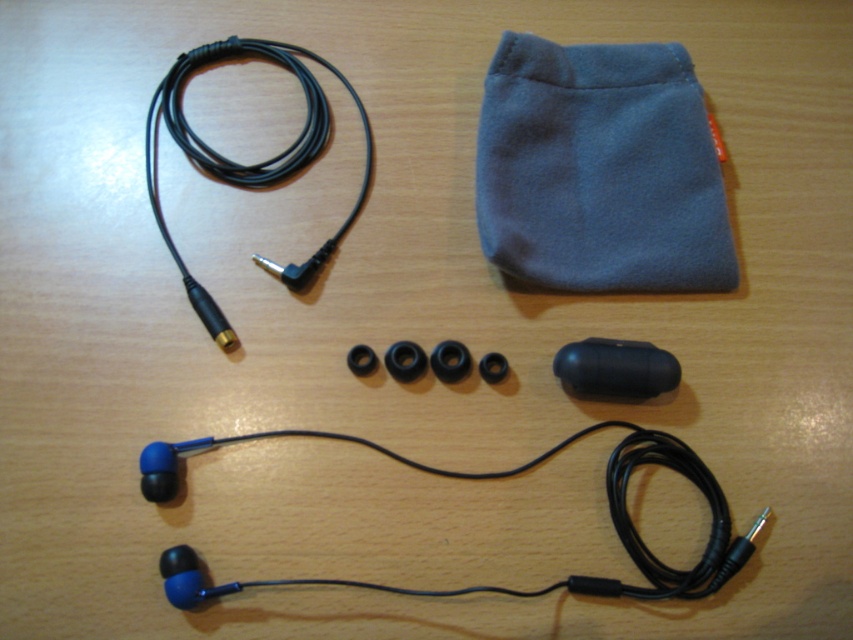
You are organizing a gift set and need to place the blue fleece pouch at upper right and the blue matte earphones at bottom into a small box. The box has limited depth. Which item should you place first to ensure both fit properly?

You should place the blue fleece pouch at upper right first because it is thinner than the blue matte earphones at bottom, allowing more space for the thicker earphones.

You are standing at a distance of 4 feet from the camera. Can you reach the point at coordinates point (631, 192) without moving closer?

The distance between point (631, 192) and the camera is 3.79 feet. Since you are standing 4 feet away from the camera, you are slightly farther than the point, so you can reach it without moving closer.